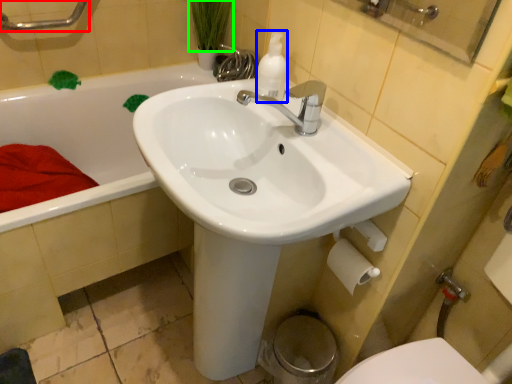
Question: Which is farther away from shower (highlighted by a red box)? cleaning product (highlighted by a blue box) or plant (highlighted by a green box)?

Choices:
 (A) cleaning product
 (B) plant

Answer: (A)